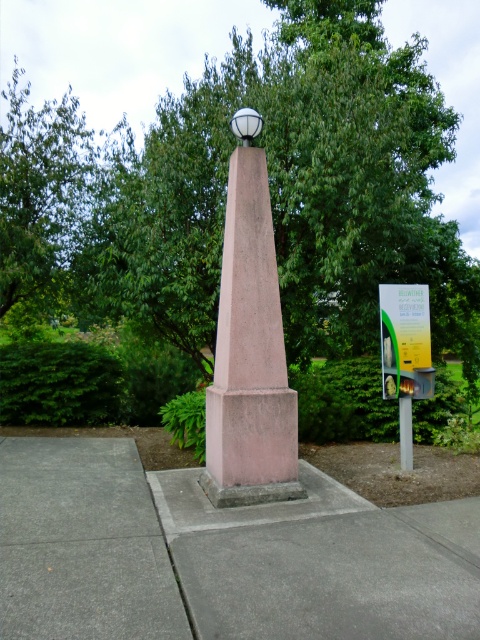
Question: Which of the following is the closest to the observer?

Choices:
 (A) (408, 438)
 (B) (0, 580)
 (C) (300, 291)
 (D) (284, 497)

Answer: (B)

Question: Does green leafy tree at center have a lesser width compared to pink concrete obelisk at center?

Choices:
 (A) no
 (B) yes

Answer: (B)

Question: Is green leafy tree at center smaller than metallic gray pole at center?

Choices:
 (A) no
 (B) yes

Answer: (A)

Question: Is green leafy tree at center to the right of gray concrete pavement at center from the viewer's perspective?

Choices:
 (A) yes
 (B) no

Answer: (B)

Question: Which object is farther from the camera taking this photo?

Choices:
 (A) green leafy tree at center
 (B) metallic gray pole at center
 (C) gray concrete pavement at center

Answer: (A)

Question: Estimate the real-world distances between objects in this image. Which object is farther from the green leafy tree at center?

Choices:
 (A) gray concrete pavement at center
 (B) metallic gray pole at center
 (C) pink concrete obelisk at center

Answer: (A)